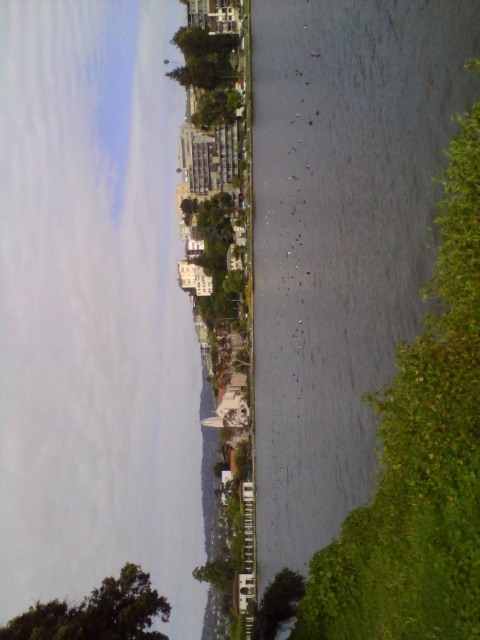
Does green leafy tree at lower right appear under green leafy tree at lower center?

No.

Is point (464, 291) farther from camera compared to point (294, 611)?

That is False.

Image resolution: width=480 pixels, height=640 pixels. I want to click on green leafy tree at lower right, so click(x=420, y=458).

Is point (132, 577) more distant than point (274, 612)?

No, it is not.

Who is taller, green leafy tree at lower left or green leafy tree at lower center?

green leafy tree at lower center

Is point (116, 580) farther from viewer compared to point (290, 593)?

No.

This screenshot has height=640, width=480. Identify the location of green leafy tree at lower left. (96, 612).

Based on the photo, is clear water at center further to camera compared to green leafy tree at lower right?

Yes, clear water at center is further from the viewer.

Is point (45, 499) positioned in front of point (444, 490)?

No.

Where is `clear water at center`? The image size is (480, 640). clear water at center is located at coordinates (95, 308).